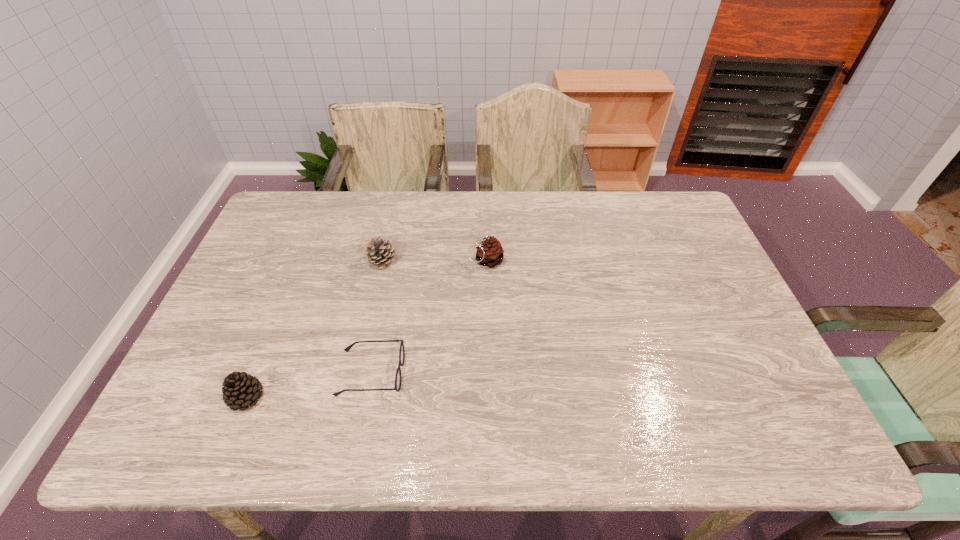
Where is `vacant space in between the rightmost pinecone and the shortest object`? Image resolution: width=960 pixels, height=540 pixels. vacant space in between the rightmost pinecone and the shortest object is located at coordinates (428, 317).

Identify the location of free area in between the second pinecone from right to left and the leftmost pinecone. (314, 329).

Where is `blank region between the second pinecone from left to right and the rightmost object`? The width and height of the screenshot is (960, 540). blank region between the second pinecone from left to right and the rightmost object is located at coordinates (434, 261).

Locate an element on the screen. The image size is (960, 540). vacant area that lies between the spectacles and the rightmost pinecone is located at coordinates (428, 317).

At what (x,y) coordinates should I click in order to perform the action: click on unoccupied area between the leftmost object and the rightmost object. Please return your answer as a coordinate pair (x, y). Looking at the image, I should click on (366, 329).

The image size is (960, 540). Identify the location of free space that is in between the second pinecone from right to left and the nearest pinecone. (314, 329).

Locate an element on the screen. vacant space in between the rightmost pinecone and the spectacles is located at coordinates (428, 317).

You are a GUI agent. You are given a task and a screenshot of the screen. Output one action in this format:
    pyautogui.click(x=<x>, y=<y>)
    Task: Click on the free space between the rightmost pinecone and the leftmost pinecone
    This screenshot has height=540, width=960.
    Given the screenshot: What is the action you would take?
    pyautogui.click(x=366, y=329)

This screenshot has width=960, height=540. I want to click on free space between the second pinecone from left to right and the shortest object, so click(376, 317).

Identify the location of vacant space that is in between the second pinecone from left to right and the spectacles. (376, 317).